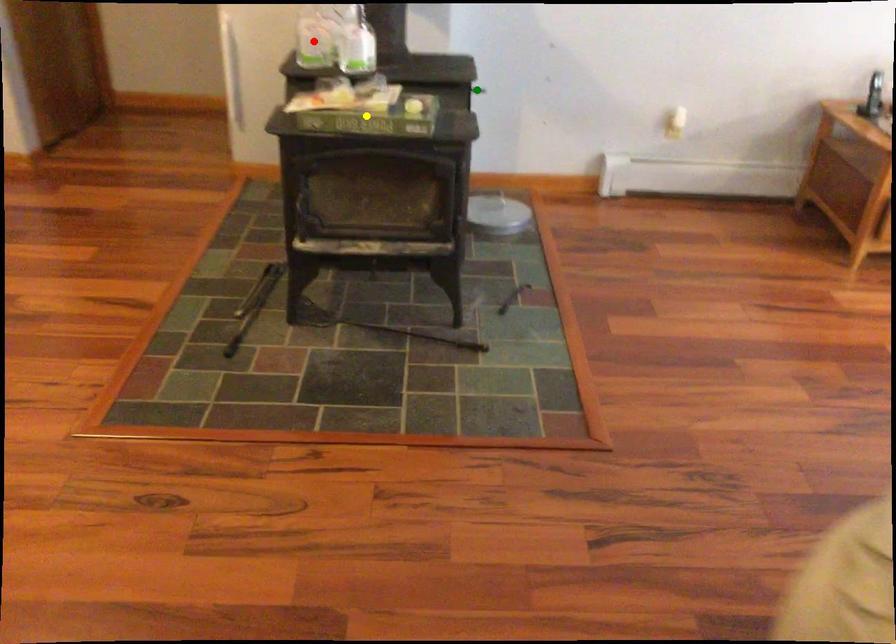
Consider the image. Order these from nearest to farthest:
red point | green point | yellow point

yellow point, red point, green point